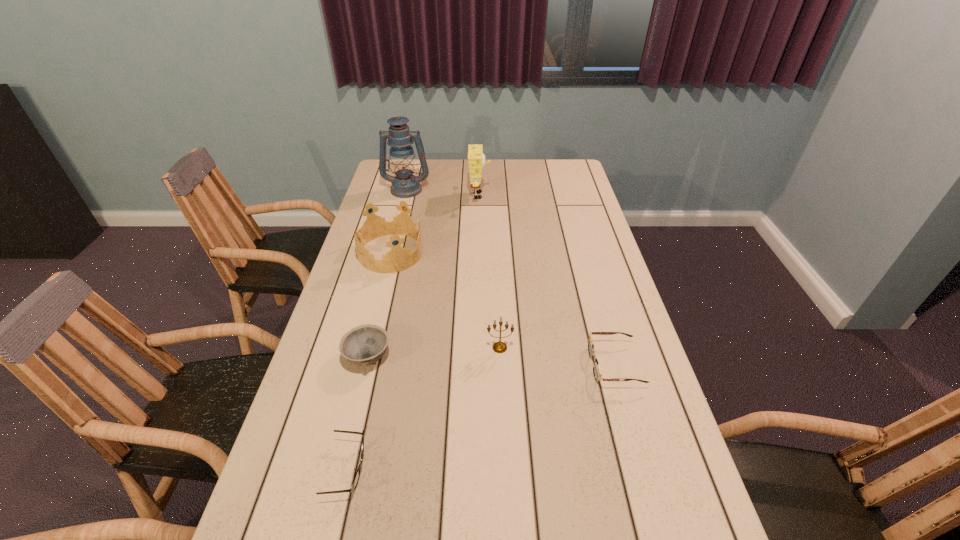
Locate an element on the screen. The image size is (960, 540). lantern at the left edge is located at coordinates pos(404,185).

At what (x,y) coordinates should I click in order to perform the action: click on tiara that is at the left edge. Please return your answer as a coordinate pair (x, y). The height and width of the screenshot is (540, 960). Looking at the image, I should click on (398, 258).

You are a GUI agent. You are given a task and a screenshot of the screen. Output one action in this format:
    pyautogui.click(x=<x>, y=<y>)
    Task: Click on the bowl that is at the left edge
    The image size is (960, 540).
    Given the screenshot: What is the action you would take?
    pyautogui.click(x=363, y=345)

Where is `spectacles present at the left edge`? The height and width of the screenshot is (540, 960). spectacles present at the left edge is located at coordinates (356, 479).

You are a GUI agent. You are given a task and a screenshot of the screen. Output one action in this format:
    pyautogui.click(x=<x>, y=<y>)
    Task: Click on the object that is at the right edge
    The width and height of the screenshot is (960, 540).
    Given the screenshot: What is the action you would take?
    pyautogui.click(x=596, y=369)

Find the location of a particular element. object at the far left corner is located at coordinates (404, 185).

Image resolution: width=960 pixels, height=540 pixels. In the image, there is a desktop. Identify the location of vacant space at the far edge. (511, 167).

Identify the location of vacant area at the left edge. This screenshot has height=540, width=960. (348, 311).

The image size is (960, 540). What are the coordinates of `blank space at the right edge` in the screenshot? It's located at click(582, 198).

In the image, there is a desktop. At what (x,y) coordinates should I click in order to perform the action: click on free space at the far right corner. Please return your answer as a coordinate pair (x, y). The width and height of the screenshot is (960, 540). Looking at the image, I should click on (574, 161).